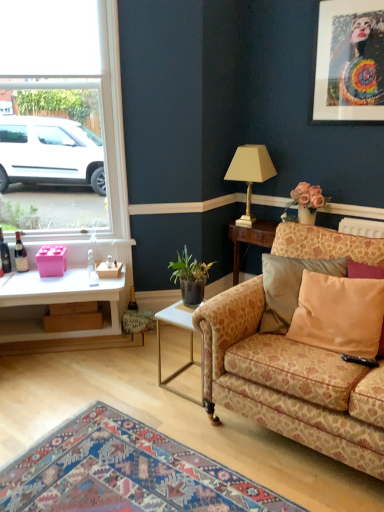
Locate an element on the screen. The image size is (384, 512). unoccupied area in front of matte glass bottle at left, the 1th bottle when ordered from left to right is located at coordinates (8, 278).